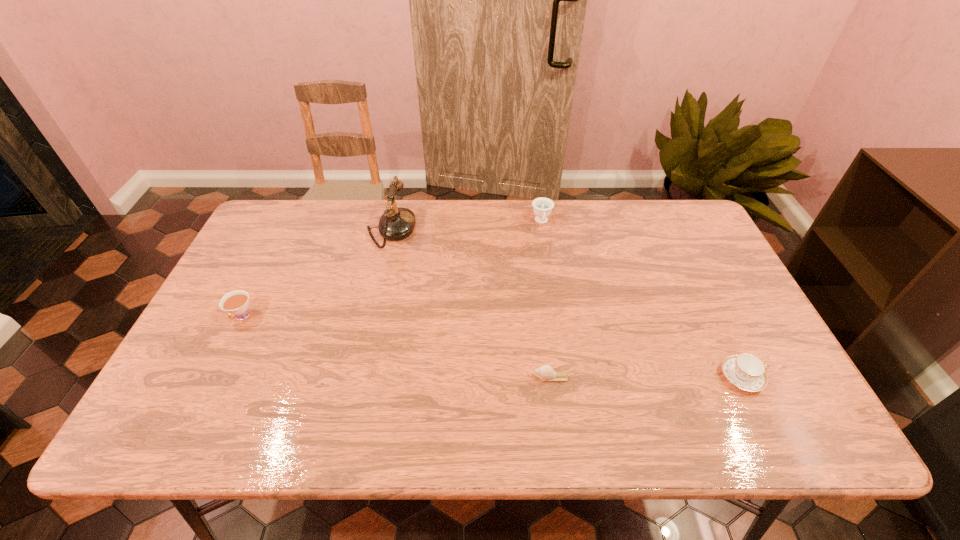
The image size is (960, 540). What are the coordinates of `free space at the left edge of the desktop` in the screenshot? It's located at (276, 279).

In the image, there is a desktop. Where is `vacant space at the right edge`? Image resolution: width=960 pixels, height=540 pixels. vacant space at the right edge is located at coordinates (772, 361).

In the image, there is a desktop. Where is `vacant area at the far left corner`? Image resolution: width=960 pixels, height=540 pixels. vacant area at the far left corner is located at coordinates (260, 237).

In the image, there is a desktop. Identify the location of vacant region at the near left corner. The width and height of the screenshot is (960, 540). (199, 440).

Locate an element on the screen. vacant space at the far right corner of the desktop is located at coordinates (698, 221).

At what (x,y) coordinates should I click in order to perform the action: click on vacant position at the near right corner of the desktop. Please return your answer as a coordinate pair (x, y). This screenshot has width=960, height=540. Looking at the image, I should click on (822, 442).

The image size is (960, 540). I want to click on free point between the farthest teacup and the rightmost object, so [x=641, y=299].

Identify the location of empty space that is in between the second teacup from left to right and the leftmost object. (392, 269).

Where is `free space that is in between the farthest teacup and the telephone`? free space that is in between the farthest teacup and the telephone is located at coordinates (467, 226).

Where is `vacant area between the rightmost teacup and the escargot`? This screenshot has width=960, height=540. vacant area between the rightmost teacup and the escargot is located at coordinates (647, 377).